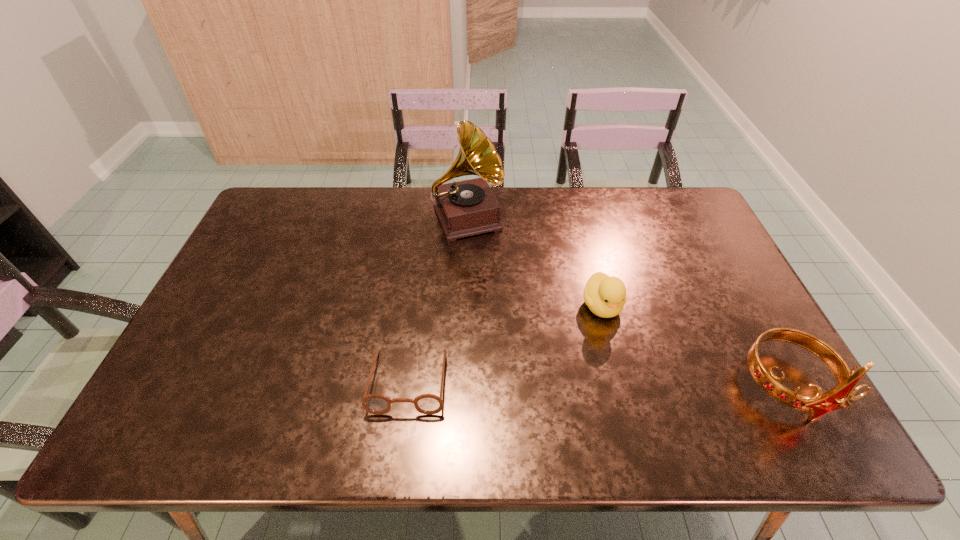
Identify the location of free space between the spectacles and the third shortest object. Image resolution: width=960 pixels, height=540 pixels. (598, 383).

Where is `free spot between the phonograph record and the spectacles`? This screenshot has height=540, width=960. free spot between the phonograph record and the spectacles is located at coordinates (438, 300).

What are the coordinates of `object that can be found as the closest to the phonograph record` in the screenshot? It's located at (605, 296).

Locate which object ranks third in proximity to the spectacles. Please provide its 2D coordinates. Your answer should be formatted as a tuple, i.e. [(x, y)], where the tuple contains the x and y coordinates of a point satisfying the conditions above.

[(819, 404)]